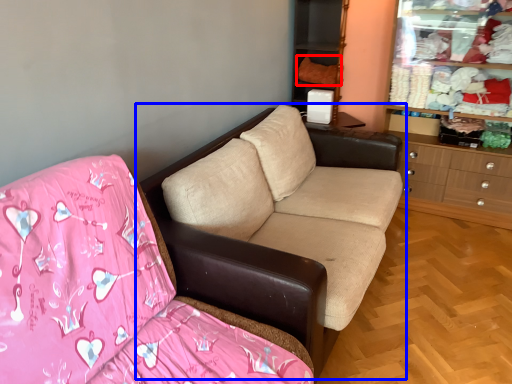
Question: Which object appears farthest to the camera in this image, clothing (highlighted by a red box) or studio couch (highlighted by a blue box)?

Choices:
 (A) clothing
 (B) studio couch

Answer: (A)